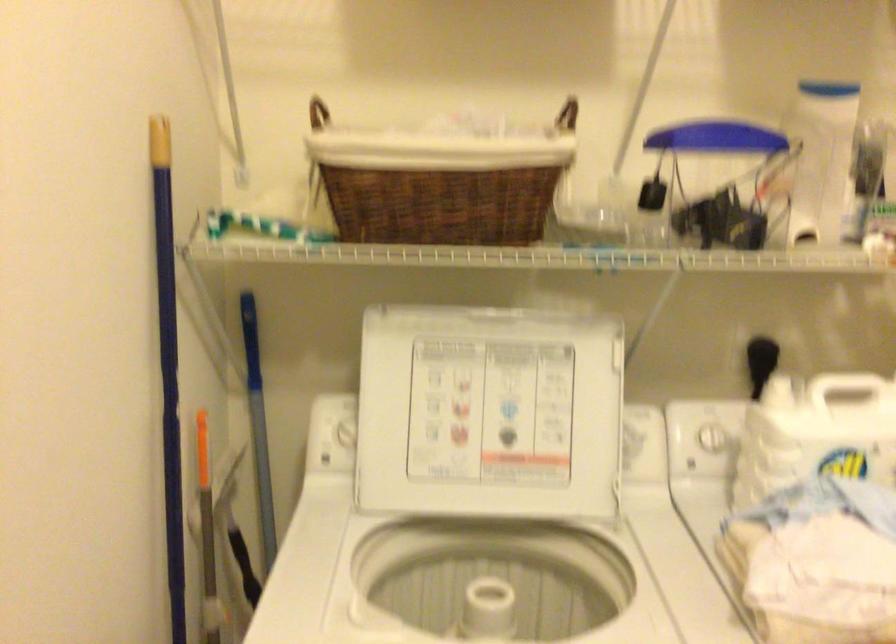
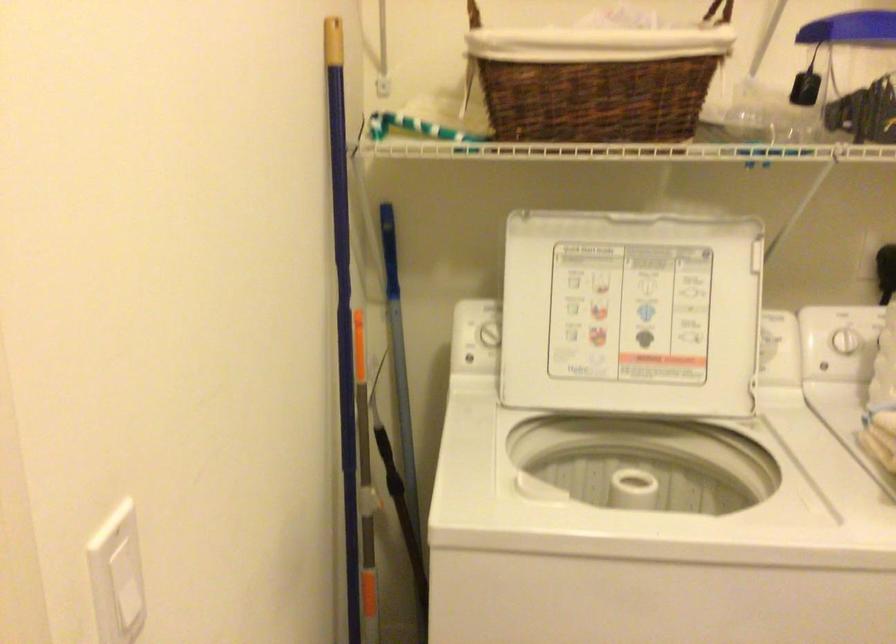
In a continuous first-person perspective shot, in which direction is the camera moving?

The cameraman moved toward left, backward.